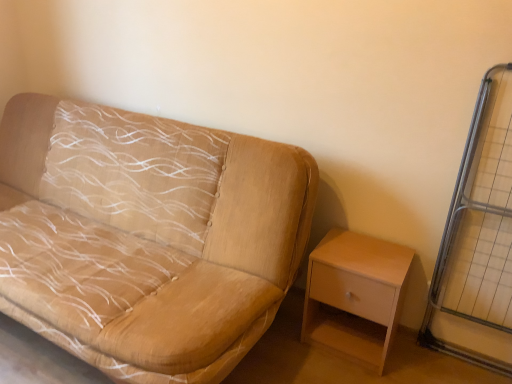
Image resolution: width=512 pixels, height=384 pixels. What are the coordinates of `vacant space in metal grid at right (from a real-world perspective)` in the screenshot? It's located at (465, 363).